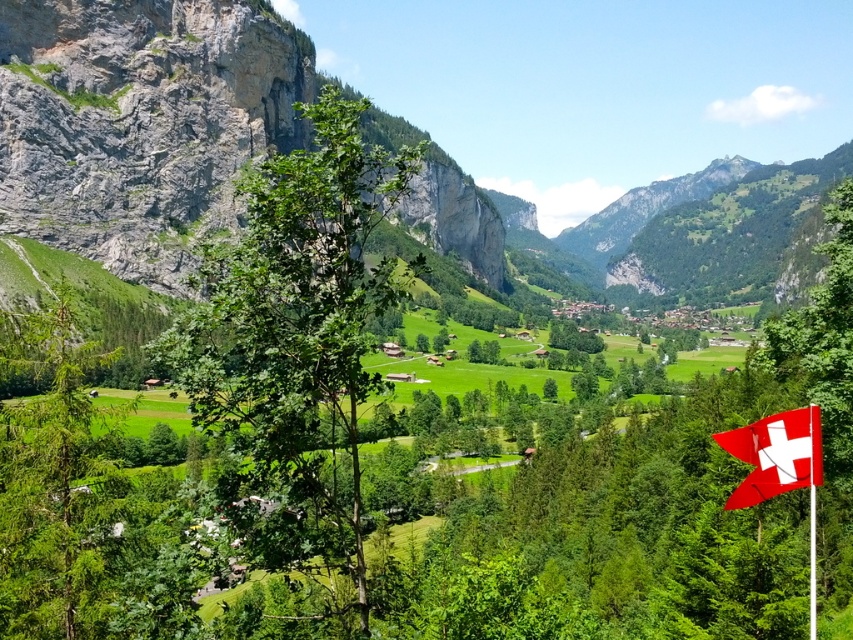
Question: Which of these objects is positioned closest to the green matte tree at left?

Choices:
 (A) green leafy tree at center
 (B) red fabric flag at lower right

Answer: (A)

Question: Considering the relative positions of rugged stone mountain at left and green leafy tree at center in the image provided, where is rugged stone mountain at left located with respect to green leafy tree at center?

Choices:
 (A) left
 (B) right

Answer: (A)

Question: Can you confirm if green matte tree at left is smaller than red fabric flag at lower right?

Choices:
 (A) yes
 (B) no

Answer: (B)

Question: Which object is the farthest from the green matte tree at left?

Choices:
 (A) red fabric flag at lower right
 (B) green leafy tree at center

Answer: (A)

Question: Which object appears farthest from the camera in this image?

Choices:
 (A) rugged stone mountain at left
 (B) red fabric flag at lower right
 (C) green matte tree at left

Answer: (A)

Question: Can you confirm if rugged stone mountain at left is positioned below green matte tree at left?

Choices:
 (A) no
 (B) yes

Answer: (A)